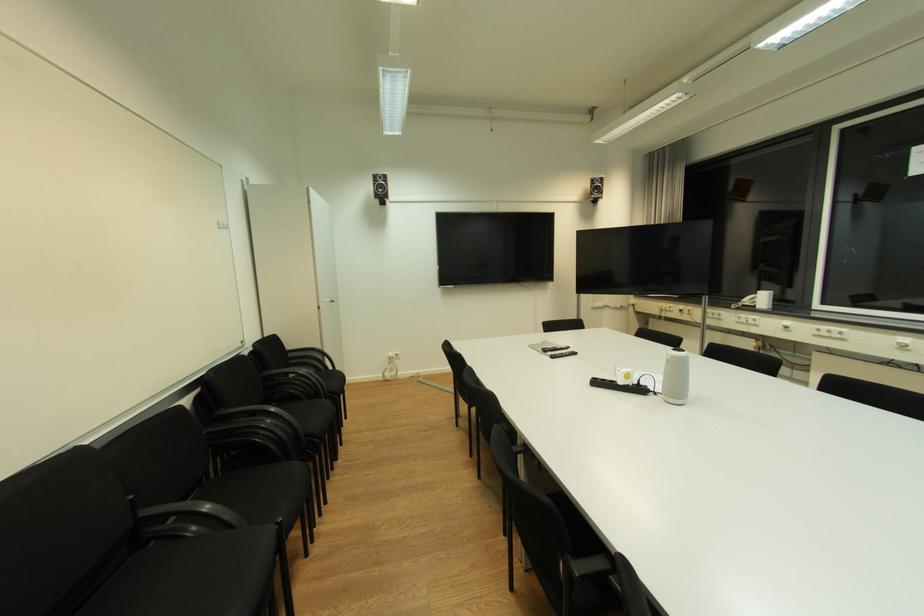
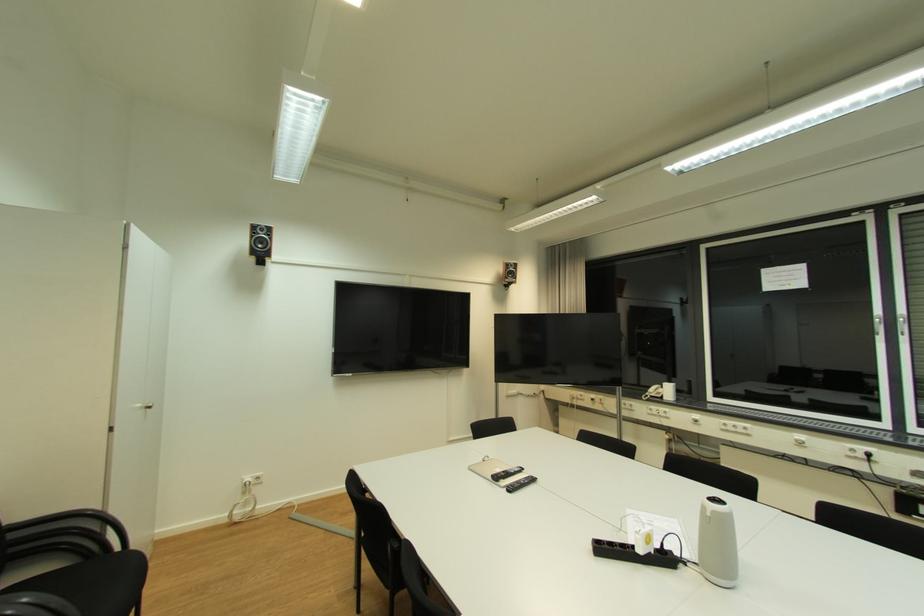
Find the pixel in the second image that matches the point at 556,355 in the first image.

(514, 488)